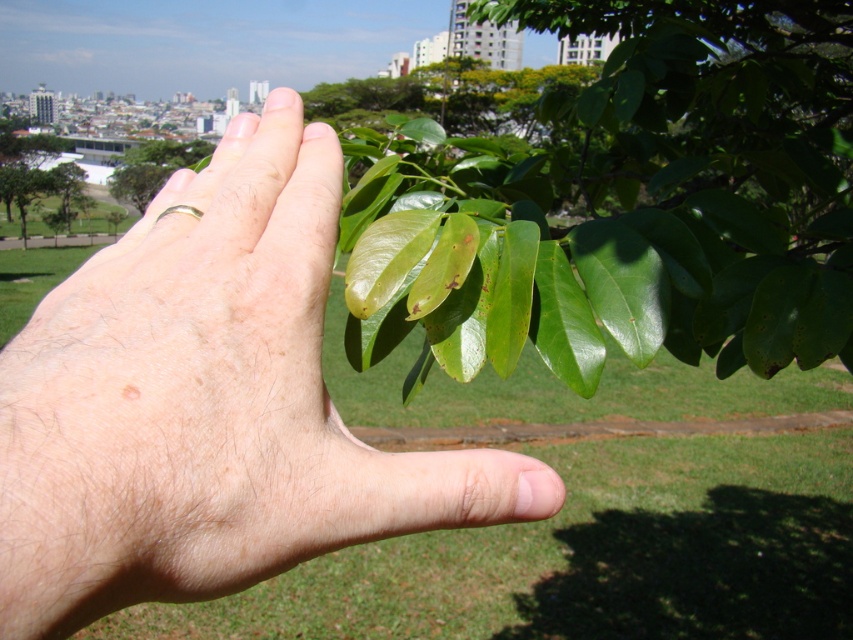
You are a photographer trying to capture a close detail of the hand holding the branch. You want to focus on the point that is closer to the camera. Which coordinate point should you choose between point (210,304) and point (6,140)?

Point (210,304) is closer to the camera than point (6,140), so you should choose point (210,304) to focus on for the close detail.

You are a botanist examining the green glossy leaves at upper center and the green glossy leaf at upper left in the image. Which leaf is positioned lower in the scene?

The green glossy leaves at upper center is located below the green glossy leaf at upper left, so the green glossy leaves at upper center is positioned lower in the scene.